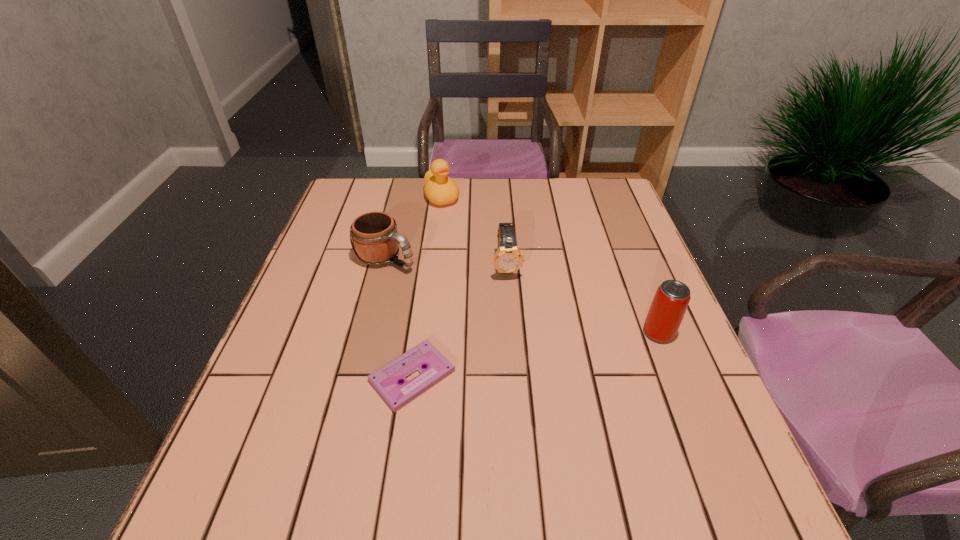
The width and height of the screenshot is (960, 540). In order to click on free space on the desktop that is between the shortest object and the rightmost object and is positioned on the side of the mug with the handle in this screenshot , I will do `click(560, 350)`.

Where is `free space on the desktop that is between the shortest object and the rightmost object and is positioned on the face of the fourth object from left to right`? Image resolution: width=960 pixels, height=540 pixels. free space on the desktop that is between the shortest object and the rightmost object and is positioned on the face of the fourth object from left to right is located at coordinates (523, 356).

The width and height of the screenshot is (960, 540). I want to click on vacant space on the desktop that is between the videotape and the rightmost object and is positioned on the face of the farthest object, so click(545, 353).